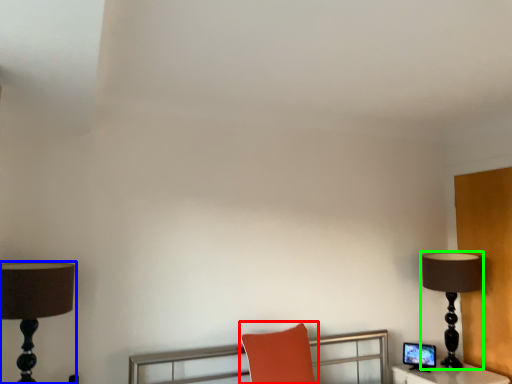
Question: Which is farther away from swivel chair (highlighted by a red box)? lamp (highlighted by a blue box) or lamp (highlighted by a green box)?

Choices:
 (A) lamp
 (B) lamp

Answer: (A)